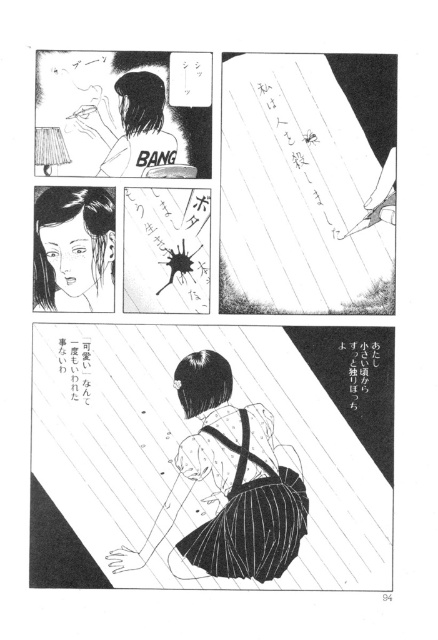
Is smooth black hair at center shorter than black paper at lower left?

No.

Is smooth black hair at center further to camera compared to black paper at lower left?

No, it is not.

Image resolution: width=438 pixels, height=640 pixels. I want to click on smooth black hair at center, so coord(74,250).

Is black striped skirt at center taller than black paper at lower left?

Correct, black striped skirt at center is much taller as black paper at lower left.

Is black striped skirt at center to the right of black paper at lower left from the viewer's perspective?

Correct, you'll find black striped skirt at center to the right of black paper at lower left.

Image resolution: width=438 pixels, height=640 pixels. What do you see at coordinates (232, 483) in the screenshot? I see `black striped skirt at center` at bounding box center [232, 483].

The height and width of the screenshot is (640, 438). What are the coordinates of `black striped skirt at center` in the screenshot? It's located at (232, 483).

Between black striped skirt at center and black paper at lower right, which one appears on the left side from the viewer's perspective?

black striped skirt at center

Between black striped skirt at center and black paper at lower right, which one is positioned higher?

black paper at lower right

This screenshot has width=438, height=640. What do you see at coordinates (232, 483) in the screenshot?
I see `black striped skirt at center` at bounding box center [232, 483].

The image size is (438, 640). I want to click on black striped skirt at center, so click(232, 483).